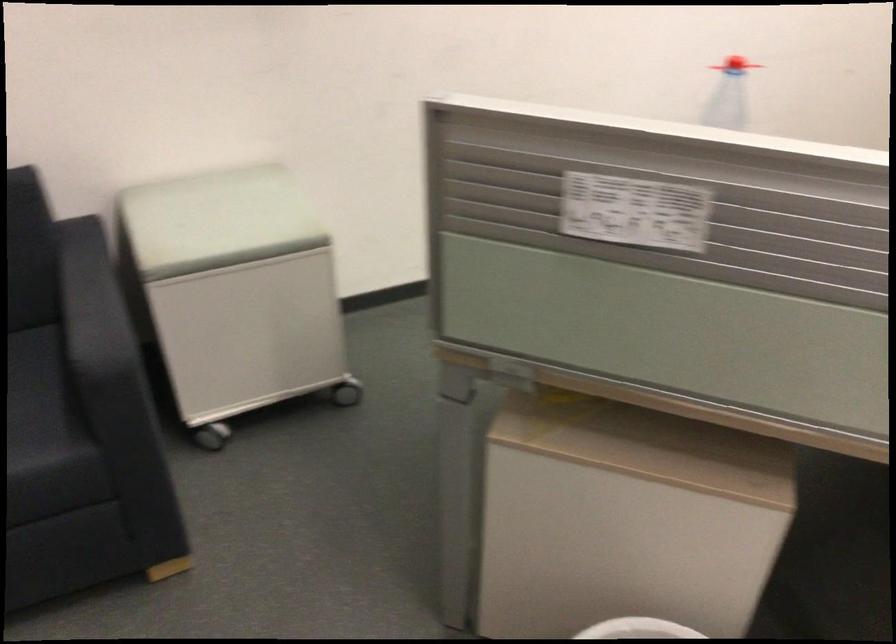
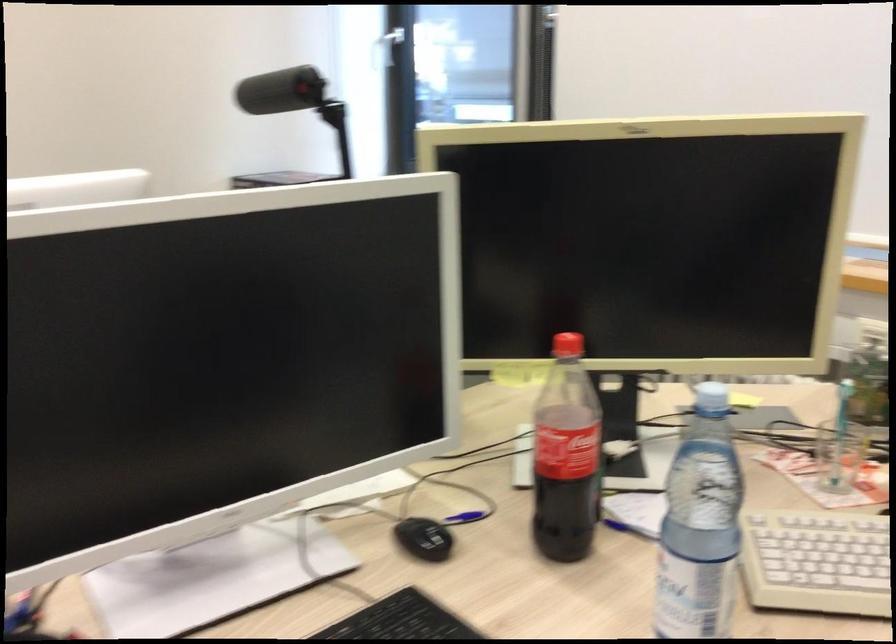
Question: In a continuous first-person perspective shot, in which direction is the camera moving?

Choices:
 (A) Left
 (B) Right
 (C) Forward
 (D) Backward

Answer: (B)